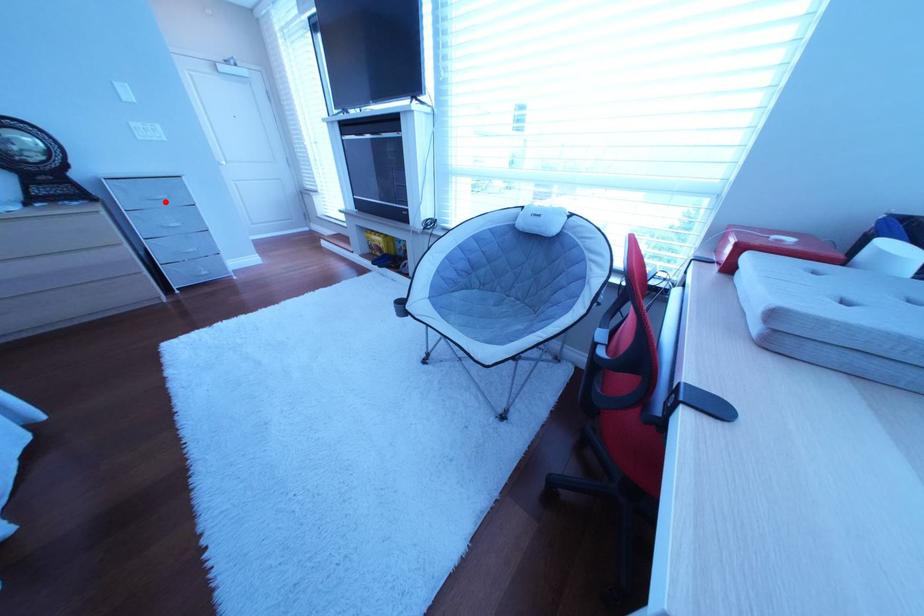
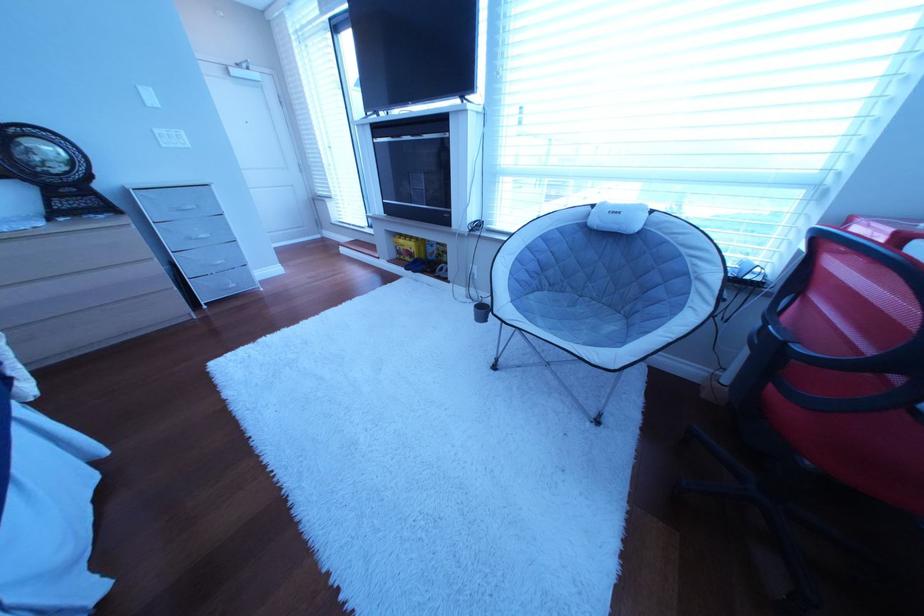
Locate, in the second image, the point that corresponds to the highlighted location in the first image.

(193, 213)